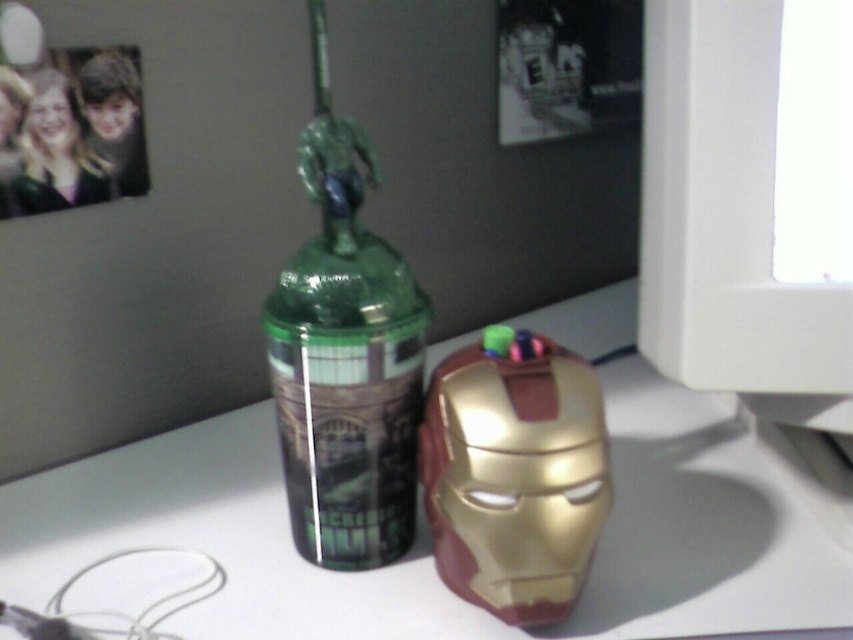
Question: Is white glossy table at center smaller than gold metallic iron man mask at center?

Choices:
 (A) no
 (B) yes

Answer: (A)

Question: Among these objects, which one is farthest from the camera?

Choices:
 (A) white glossy table at center
 (B) gold metallic iron man mask at center
 (C) green glossy bottle at center

Answer: (C)

Question: Does green glossy bottle at center appear on the right side of gold metallic iron man mask at center?

Choices:
 (A) yes
 (B) no

Answer: (B)

Question: Which object appears closest to the camera in this image?

Choices:
 (A) white glossy table at center
 (B) gold metallic iron man mask at center
 (C) green glossy bottle at center

Answer: (B)

Question: Estimate the real-world distances between objects in this image. Which object is farther from the green glossy bottle at center?

Choices:
 (A) gold metallic iron man mask at center
 (B) white glossy table at center

Answer: (B)

Question: Does green glossy bottle at center have a larger size compared to gold metallic iron man mask at center?

Choices:
 (A) yes
 (B) no

Answer: (A)